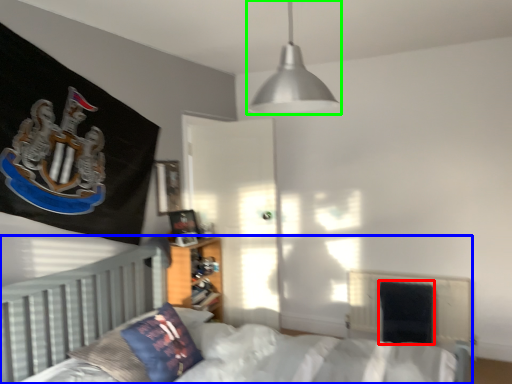
Question: Considering the real-world distances, which object is farthest from armchair (highlighted by a red box)? bed (highlighted by a blue box) or lamp (highlighted by a green box)?

Choices:
 (A) bed
 (B) lamp

Answer: (B)